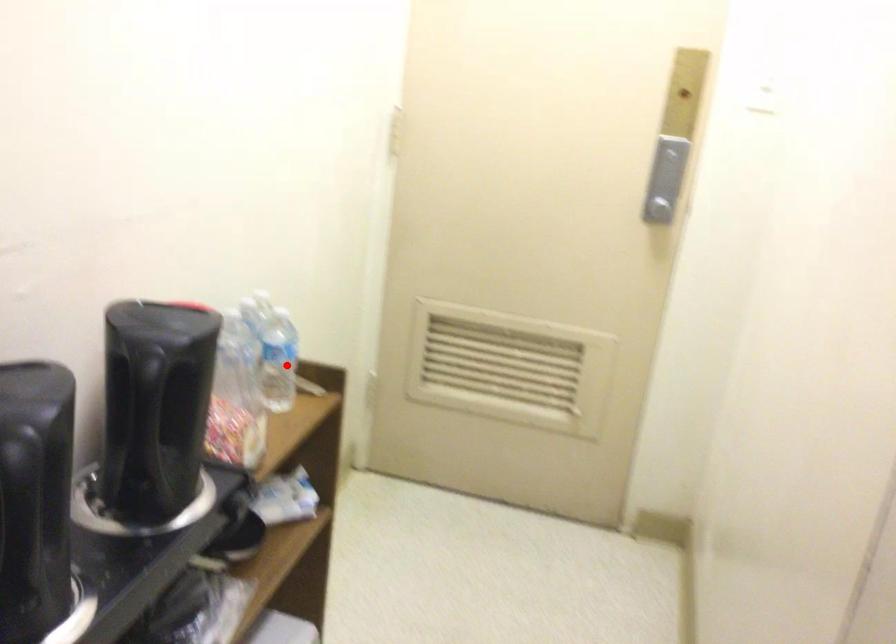
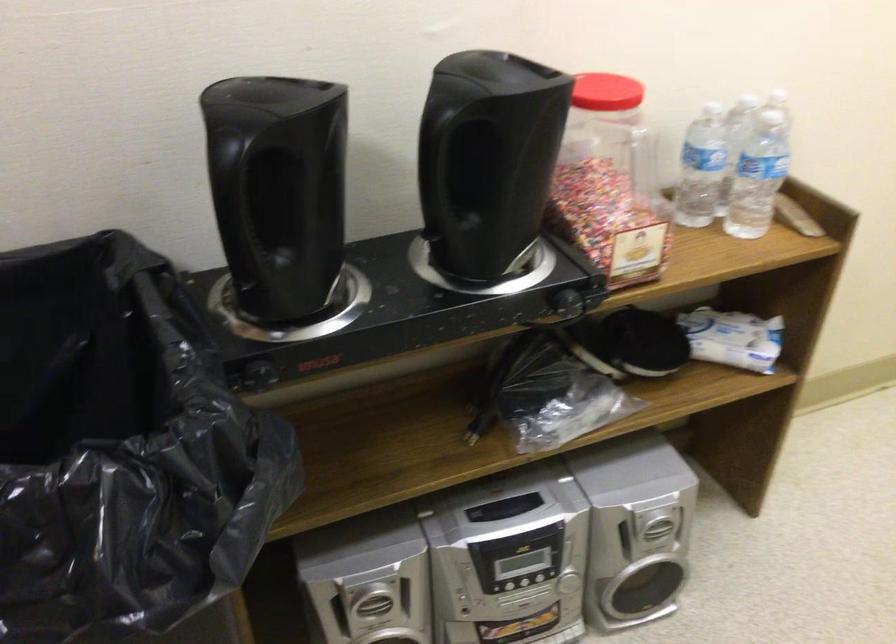
Question: A red point is marked in image1. In image2, is the corresponding 3D point closer to the camera or farther? Reply with the corresponding letter.

Choices:
 (A) The corresponding 3D point is closer.
 (B) The corresponding 3D point is farther.

Answer: (A)